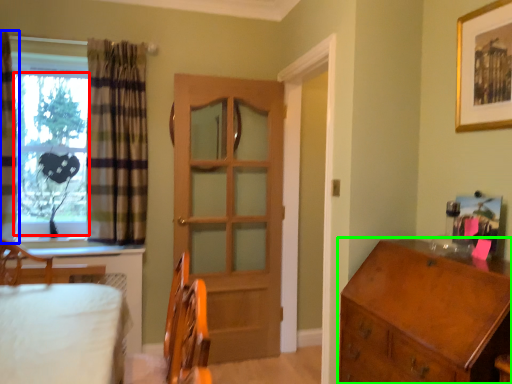
Question: Which is nearer to the window screen (highlighted by a red box)? curtain (highlighted by a blue box) or chest of drawers (highlighted by a green box).

Choices:
 (A) curtain
 (B) chest of drawers

Answer: (A)